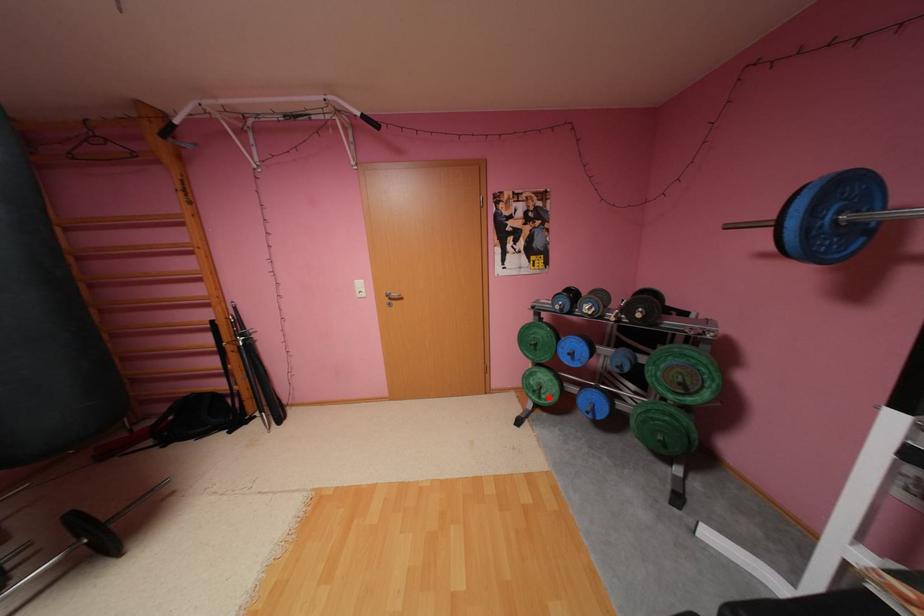
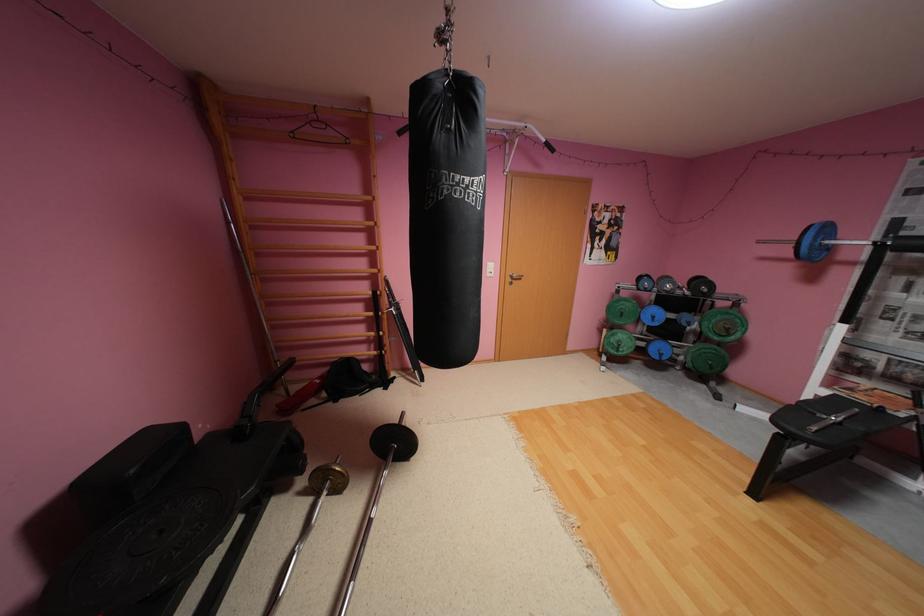
Question: I am providing you with two images of the same scene from different viewpoints. Image1 has a red point marked. In image2, the corresponding 3D location appears at what relative position? Reply with the corresponding letter.

Choices:
 (A) Closer
 (B) Farther

Answer: (A)